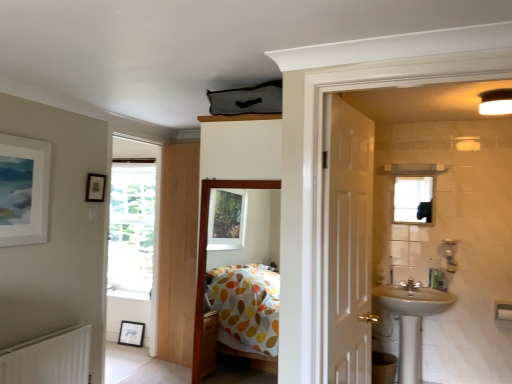
Question: In terms of width, does polka dot fabric bed at center look wider or thinner when compared to matte black picture frame at upper left, which is the third picture frame in bottom-to-top order?

Choices:
 (A) thin
 (B) wide

Answer: (B)

Question: Do you think polka dot fabric bed at center is within matte black picture frame at upper left, positioned as the second picture frame in back-to-front order, or outside of it?

Choices:
 (A) inside
 (B) outside

Answer: (B)

Question: Which object is the farthest from the matte black picture frame at upper left, positioned as the second picture frame in back-to-front order?

Choices:
 (A) matte white picture frame at upper left, positioned as the 2th picture frame in top-to-bottom order
 (B) polka dot fabric bed at center
 (C) black matte picture frame at lower left, positioned as the 1th picture frame in bottom-to-top order
 (D) white matte light fixture at upper right
 (E) silver metallic tap at right

Answer: (D)

Question: Which object is positioned farthest from the clear glass mirror at upper right?

Choices:
 (A) white matte light fixture at upper right
 (B) polka dot fabric bed at center
 (C) white ceramic sink at lower right
 (D) white matte radiator at lower left
 (E) silver metallic tap at right

Answer: (D)